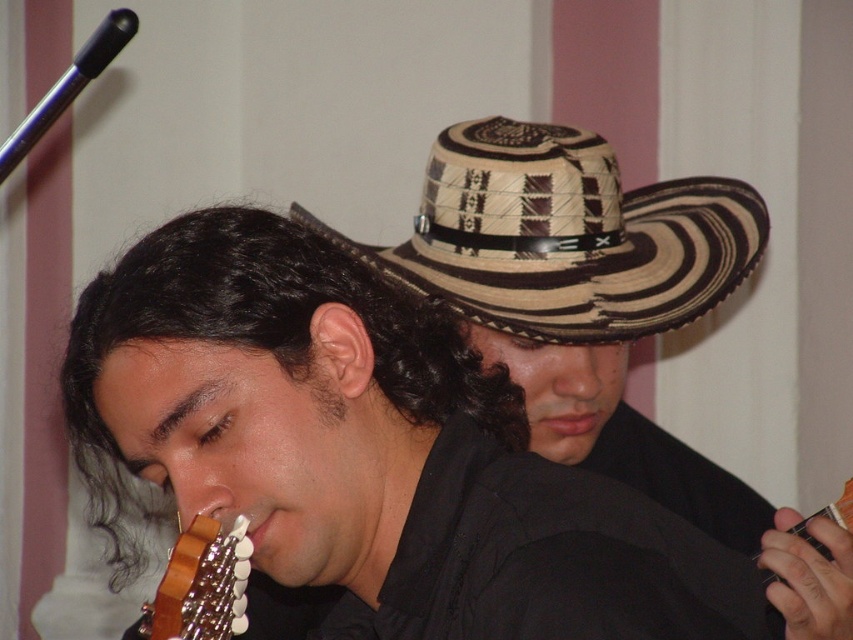
Question: Which object is the farthest from the brown woven straw cowboy hat at upper center?

Choices:
 (A) wooden acoustic guitar at lower left
 (B) wooden acoustic guitar at lower right

Answer: (A)

Question: From the image, what is the correct spatial relationship of wooden acoustic guitar at lower left in relation to wooden acoustic guitar at lower right?

Choices:
 (A) left
 (B) right

Answer: (A)

Question: Estimate the real-world distances between objects in this image. Which object is farther from the brown woven straw cowboy hat at upper center?

Choices:
 (A) wooden acoustic guitar at lower right
 (B) wooden acoustic guitar at lower left

Answer: (B)

Question: Does wooden acoustic guitar at lower left appear on the right side of wooden acoustic guitar at lower right?

Choices:
 (A) no
 (B) yes

Answer: (A)

Question: Among these points, which one is nearest to the camera?

Choices:
 (A) (828, 548)
 (B) (218, 566)
 (C) (646, 189)

Answer: (B)

Question: Is brown woven straw cowboy hat at upper center above wooden acoustic guitar at lower right?

Choices:
 (A) no
 (B) yes

Answer: (B)